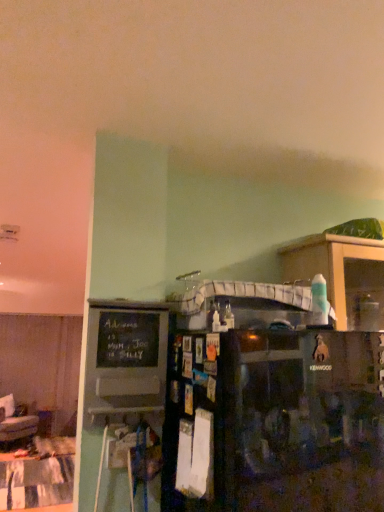
I want to click on black matte refrigerator at center, so click(x=256, y=397).

Describe the element at coordinates (126, 357) in the screenshot. I see `black chalkboard at left` at that location.

What is the approximate height of patchwork fabric table at lower left?

patchwork fabric table at lower left is 1.35 inches in height.

This screenshot has width=384, height=512. Describe the element at coordinates (338, 269) in the screenshot. I see `wooden cabinet at right` at that location.

Locate an element on the screen. This screenshot has height=512, width=384. black matte refrigerator at center is located at coordinates (256, 397).

Is point (129, 375) behind point (144, 306)?

No, (129, 375) is in front of (144, 306).

From a real-world perspective, is black chalkboard at left physically located above or below black matte refrigerator at center?

black chalkboard at left is situated higher than black matte refrigerator at center in the real world.

Looking at this image, is black chalkboard at left inside or outside of black matte refrigerator at center?

The correct answer is: outside.

Is black chalkboard at left further to camera compared to black matte refrigerator at center?

Yes, black chalkboard at left is further from the camera.

Between black matte refrigerator at center and patchwork fabric table at lower left, which one has larger width?

patchwork fabric table at lower left is wider.

From a real-world perspective, which is physically above, black matte refrigerator at center or patchwork fabric table at lower left?

In real-world perspective, black matte refrigerator at center is above.

Considering the relative sizes of black matte refrigerator at center and patchwork fabric table at lower left in the image provided, is black matte refrigerator at center bigger than patchwork fabric table at lower left?

Yes.

Which object is further away from the camera, black matte refrigerator at center or black chalkboard at left?

black chalkboard at left is behind.

Between black matte refrigerator at center and black chalkboard at left, which one has larger size?

black matte refrigerator at center.

Is point (94, 359) positioned before point (128, 393)?

Yes, point (94, 359) is in front of point (128, 393).

Would you say wooden cabinet at right is inside or outside black matte refrigerator at center?

wooden cabinet at right is spatially situated outside black matte refrigerator at center.

Considering the positions of points (344, 273) and (273, 422), is point (344, 273) closer to camera compared to point (273, 422)?

No, (344, 273) is further to viewer.

Which object is positioned more to the left, wooden cabinet at right or black matte refrigerator at center?

black matte refrigerator at center.

Is patchwork fabric table at lower left aimed at black matte refrigerator at center?

No.

How much distance is there between patchwork fabric table at lower left and black matte refrigerator at center?

A distance of 1.80 meters exists between patchwork fabric table at lower left and black matte refrigerator at center.

From a real-world perspective, is patchwork fabric table at lower left located higher than black matte refrigerator at center?

No, from a real-world perspective, patchwork fabric table at lower left is not over black matte refrigerator at center

Locate an element on the screen. entertainment center above the patchwork fabric table at lower left (from a real-world perspective) is located at coordinates (256, 397).

Is black chalkboard at left outside of patchwork fabric table at lower left?

Absolutely, black chalkboard at left is external to patchwork fabric table at lower left.

From a real-world perspective, is black chalkboard at left positioned above or below patchwork fabric table at lower left?

black chalkboard at left is above patchwork fabric table at lower left.

Between black chalkboard at left and patchwork fabric table at lower left, which one has more height?

black chalkboard at left is taller.

In the image, there is a black matte refrigerator at center. Identify the location of shelf above it (from the image's perspective). (338, 269).

Choose the correct answer: Is black matte refrigerator at center inside wooden cabinet at right or outside it?

black matte refrigerator at center exists outside the volume of wooden cabinet at right.

Which of these two, black matte refrigerator at center or wooden cabinet at right, is bigger?

With larger size is black matte refrigerator at center.

Does point (235, 398) lie behind point (353, 278)?

No, it is in front of (353, 278).

At what (x,y) coordinates should I click in order to perform the action: click on bulletin board above the black matte refrigerator at center (from a real-world perspective). Please return your answer as a coordinate pair (x, y). Looking at the image, I should click on [126, 357].

Locate an element on the screen. Image resolution: width=384 pixels, height=512 pixels. table located below the black matte refrigerator at center (from the image's perspective) is located at coordinates (36, 482).

Considering their positions, is black chalkboard at left positioned closer to patchwork fabric table at lower left than wooden cabinet at right?

Based on the image, black chalkboard at left appears to be nearer to patchwork fabric table at lower left.

Based on their spatial positions, is wooden cabinet at right or patchwork fabric table at lower left further from black chalkboard at left?

patchwork fabric table at lower left is positioned further to the anchor black chalkboard at left.

From the image, which object appears to be farther from black matte refrigerator at center, wooden cabinet at right or black chalkboard at left?

wooden cabinet at right is positioned further to the anchor black matte refrigerator at center.

When comparing their distances from wooden cabinet at right, does black chalkboard at left or black matte refrigerator at center seem closer?

black matte refrigerator at center is closer to wooden cabinet at right.

When comparing their distances from black chalkboard at left, does patchwork fabric table at lower left or black matte refrigerator at center seem further?

The object further to black chalkboard at left is patchwork fabric table at lower left.

When comparing their distances from wooden cabinet at right, does black matte refrigerator at center or black chalkboard at left seem closer?

black matte refrigerator at center is closer to wooden cabinet at right.

When comparing their distances from black chalkboard at left, does patchwork fabric table at lower left or wooden cabinet at right seem closer?

wooden cabinet at right lies closer to black chalkboard at left than the other object.

When comparing their distances from patchwork fabric table at lower left, does wooden cabinet at right or black matte refrigerator at center seem further?

The object further to patchwork fabric table at lower left is wooden cabinet at right.

You are a GUI agent. You are given a task and a screenshot of the screen. Output one action in this format:
    pyautogui.click(x=<x>, y=<y>)
    Task: Click on the shelf between black matte refrigerator at center and patchwork fabric table at lower left from front to back
    Image resolution: width=384 pixels, height=512 pixels.
    Given the screenshot: What is the action you would take?
    pyautogui.click(x=338, y=269)

Where is `bulletin board between black matte refrigerator at center and patchwork fabric table at lower left in the front-back direction`? bulletin board between black matte refrigerator at center and patchwork fabric table at lower left in the front-back direction is located at coordinates (126, 357).

The width and height of the screenshot is (384, 512). Find the location of `entertainment center between black chalkboard at left and wooden cabinet at right in the horizontal direction`. entertainment center between black chalkboard at left and wooden cabinet at right in the horizontal direction is located at coordinates (256, 397).

At what (x,y) coordinates should I click in order to perform the action: click on shelf located between black chalkboard at left and patchwork fabric table at lower left in the depth direction. Please return your answer as a coordinate pair (x, y). This screenshot has width=384, height=512. Looking at the image, I should click on (338, 269).